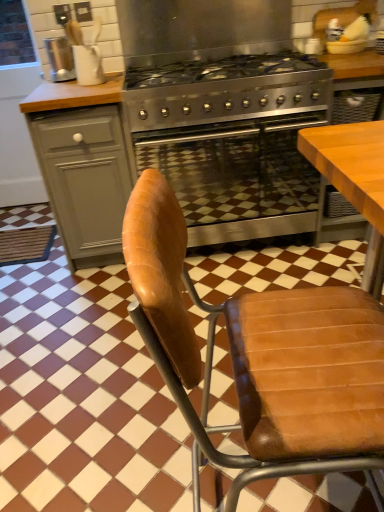
Question: From a real-world perspective, is stainless steel gas stove at center physically located above or below brown leather chair at center?

Choices:
 (A) below
 (B) above

Answer: (B)

Question: Relative to brown leather chair at center, is stainless steel gas stove at center in front or behind?

Choices:
 (A) behind
 (B) front

Answer: (A)

Question: Estimate the real-world distances between objects in this image. Which object is closer to the metallic silver kettle at upper left?

Choices:
 (A) stainless steel oven at center
 (B) stainless steel gas stove at center
 (C) matte gray cabinet at left
 (D) white matte mug at upper left
 (E) brown leather chair at center

Answer: (D)

Question: Which of these objects is positioned farthest from the matte gray cabinet at left?

Choices:
 (A) metallic silver kettle at upper left
 (B) brown leather chair at center
 (C) stainless steel oven at center
 (D) white matte mug at upper left
 (E) stainless steel gas stove at center

Answer: (B)